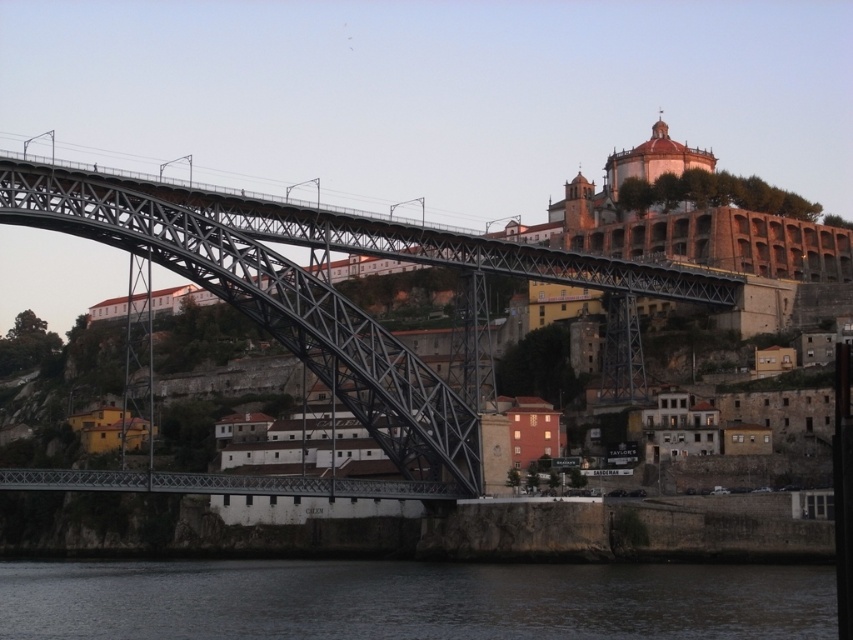
Based on the photo, you are standing on the riverbank and want to cross to the other side. The metallic steel bridge at left is your only option. However, you notice the dark water at lower center. Is the bridge closer to you than the water?

The dark water at lower center is closer to the viewer than the metallic steel bridge at left, so the bridge is farther away than the water.

You are a photographer standing on the shore of the dark water at lower center and want to capture the metallic steel bridge at left in your shot. Which direction should you turn to frame the bridge properly?

The dark water at lower center is to the left of the metallic steel bridge at left, so you should turn to your right to face the bridge and include it in your photograph.

You are a city planner assessing the image to determine if a new pedestrian walkway can be constructed between the dark water at lower center and the metallic steel bridge at left. Based on the spatial relationship between these two elements, is there enough space to safely place the walkway?

The dark water at lower center might be wider than the metallic steel bridge at left, so there could be sufficient space to safely place the walkway between them.